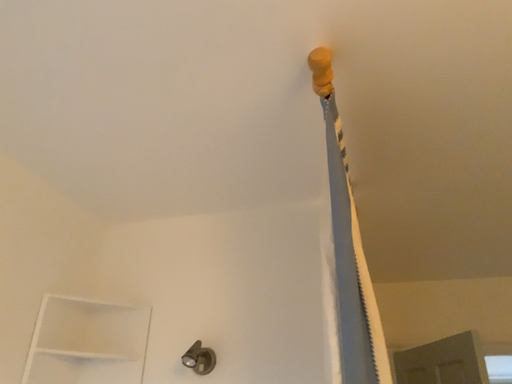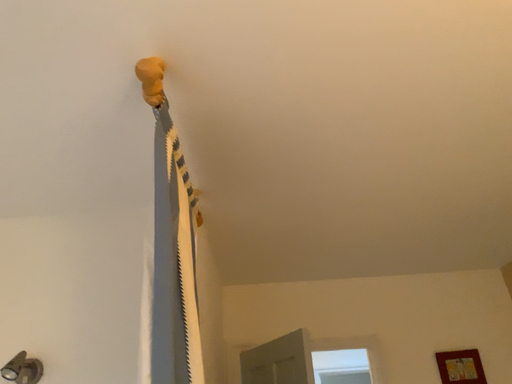
Question: How did the camera likely rotate when shooting the video?

Choices:
 (A) rotated left
 (B) rotated right

Answer: (B)